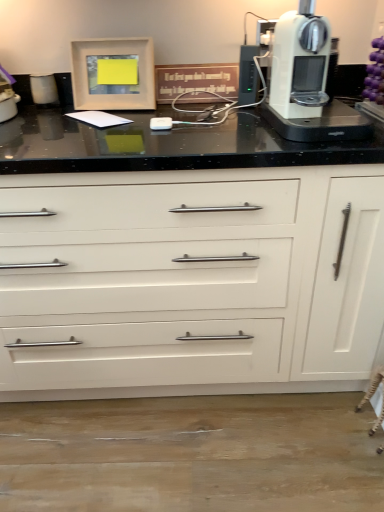
Find the location of a particular element. The height and width of the screenshot is (512, 384). matte white trash can at left is located at coordinates (44, 89).

What do you see at coordinates (44, 89) in the screenshot? This screenshot has width=384, height=512. I see `matte white trash can at left` at bounding box center [44, 89].

Image resolution: width=384 pixels, height=512 pixels. In order to click on white plastic coffee machine at upper right in this screenshot , I will do `click(307, 83)`.

From a real-world perspective, is matte white trash can at left physically above white plastic coffee machine at upper right?

Actually, matte white trash can at left is physically below white plastic coffee machine at upper right in the real world.

Would you say matte white trash can at left is to the left or to the right of white plastic coffee machine at upper right in the picture?

Clearly, matte white trash can at left is on the left of white plastic coffee machine at upper right in the image.

Is matte white trash can at left further to the viewer compared to white plastic coffee machine at upper right?

Yes, it is behind white plastic coffee machine at upper right.

Between point (33, 82) and point (304, 140), which one is positioned behind?

The point (33, 82) is farther.

Considering the relative sizes of white plastic coffee machine at upper right and matte white picture frame at upper left in the image provided, is white plastic coffee machine at upper right thinner than matte white picture frame at upper left?

In fact, white plastic coffee machine at upper right might be wider than matte white picture frame at upper left.

Considering the relative positions of white plastic coffee machine at upper right and matte white picture frame at upper left in the image provided, is white plastic coffee machine at upper right to the left of matte white picture frame at upper left from the viewer's perspective?

No, white plastic coffee machine at upper right is not to the left of matte white picture frame at upper left.

Which of these two, white plastic coffee machine at upper right or matte white picture frame at upper left, is bigger?

white plastic coffee machine at upper right is bigger.

Can you confirm if white plastic coffee machine at upper right is shorter than matte white picture frame at upper left?

Incorrect, the height of white plastic coffee machine at upper right does not fall short of that of matte white picture frame at upper left.

In the image, is matte white picture frame at upper left positioned in front of or behind matte white trash can at left?

matte white picture frame at upper left is in front of matte white trash can at left.

How many degrees apart are the facing directions of matte white picture frame at upper left and matte white trash can at left?

The angle between the facing direction of matte white picture frame at upper left and the facing direction of matte white trash can at left is 4.12 degrees.

Identify the location of picture frame on the right of matte white trash can at left. (113, 74).

Which is closer, (153, 102) or (52, 93)?

The point (153, 102) is more forward.

From the image's perspective, relative to matte white picture frame at upper left, is white glossy cabinet at center above or below?

Based on their image positions, white glossy cabinet at center is located beneath matte white picture frame at upper left.

What's the angular difference between white glossy cabinet at center and matte white picture frame at upper left's facing directions?

4.68 degrees separate the facing orientations of white glossy cabinet at center and matte white picture frame at upper left.

Is white glossy cabinet at center located outside matte white picture frame at upper left?

white glossy cabinet at center lies outside matte white picture frame at upper left's area.

From the picture: Can you confirm if white glossy cabinet at center is wider than matte white picture frame at upper left?

Yes.

Is matte white picture frame at upper left at the back of matte white trash can at left?

matte white trash can at left is not turned away from matte white picture frame at upper left.

Which is behind, point (41, 82) or point (148, 95)?

The point (41, 82) is farther.

Does matte white trash can at left touch matte white picture frame at upper left?

matte white trash can at left and matte white picture frame at upper left are not in contact.

Between matte white trash can at left and matte white picture frame at upper left, which one has larger width?

With larger width is matte white picture frame at upper left.

Would you say white plastic coffee machine at upper right is to the left or to the right of white glossy cabinet at center in the picture?

In the image, white plastic coffee machine at upper right appears on the right side of white glossy cabinet at center.

Does white plastic coffee machine at upper right have a lesser width compared to white glossy cabinet at center?

Yes, white plastic coffee machine at upper right is thinner than white glossy cabinet at center.

How distant is white plastic coffee machine at upper right from white glossy cabinet at center?

white plastic coffee machine at upper right is 41.24 centimeters from white glossy cabinet at center.

Based on the photo, could you tell me if white plastic coffee machine at upper right is turned towards white glossy cabinet at center?

No, white plastic coffee machine at upper right is not oriented towards white glossy cabinet at center.

Is matte white picture frame at upper left bigger than white glossy cabinet at center?

No, matte white picture frame at upper left is not bigger than white glossy cabinet at center.

Are matte white picture frame at upper left and white glossy cabinet at center far apart?

No, matte white picture frame at upper left is not far from white glossy cabinet at center.

Image resolution: width=384 pixels, height=512 pixels. Find the location of `picture frame lying on the left of white glossy cabinet at center`. picture frame lying on the left of white glossy cabinet at center is located at coordinates (113, 74).

Where is `kitchen appliance directly beneath the white plastic coffee machine at upper right (from a real-world perspective)`? kitchen appliance directly beneath the white plastic coffee machine at upper right (from a real-world perspective) is located at coordinates (44, 89).

Locate an element on the screen. picture frame on the left of white plastic coffee machine at upper right is located at coordinates (113, 74).

Considering their positions, is matte white trash can at left positioned further to matte white picture frame at upper left than white glossy cabinet at center?

white glossy cabinet at center.

Based on the photo, looking at the image, which one is located further to matte white trash can at left, white plastic coffee machine at upper right or matte white picture frame at upper left?

white plastic coffee machine at upper right lies further to matte white trash can at left than the other object.

Based on their spatial positions, is white plastic coffee machine at upper right or matte white picture frame at upper left closer to white glossy cabinet at center?

white plastic coffee machine at upper right is closer to white glossy cabinet at center.

Which object lies nearer to the anchor point white glossy cabinet at center, white plastic coffee machine at upper right or matte white trash can at left?

white plastic coffee machine at upper right.

Which object lies nearer to the anchor point matte white trash can at left, white glossy cabinet at center or white plastic coffee machine at upper right?

white plastic coffee machine at upper right.

Which object lies further to the anchor point white glossy cabinet at center, matte white trash can at left or matte white picture frame at upper left?

matte white trash can at left is positioned further to the anchor white glossy cabinet at center.

Based on their spatial positions, is white glossy cabinet at center or white plastic coffee machine at upper right further from matte white picture frame at upper left?

The object further to matte white picture frame at upper left is white glossy cabinet at center.

Estimate the real-world distances between objects in this image. Which object is further from white glossy cabinet at center, matte white picture frame at upper left or white plastic coffee machine at upper right?

The object further to white glossy cabinet at center is matte white picture frame at upper left.

The height and width of the screenshot is (512, 384). Identify the location of the chest of drawers located between matte white trash can at left and white plastic coffee machine at upper right in the left-right direction. (190, 282).

Locate an element on the screen. kitchen appliance between matte white picture frame at upper left and white glossy cabinet at center in the up-down direction is located at coordinates (44, 89).

Identify the location of the chest of drawers located between matte white picture frame at upper left and white plastic coffee machine at upper right in the left-right direction. Image resolution: width=384 pixels, height=512 pixels. (190, 282).

What are the coordinates of `picture frame located between matte white trash can at left and white plastic coffee machine at upper right in the left-right direction` in the screenshot? It's located at (113, 74).